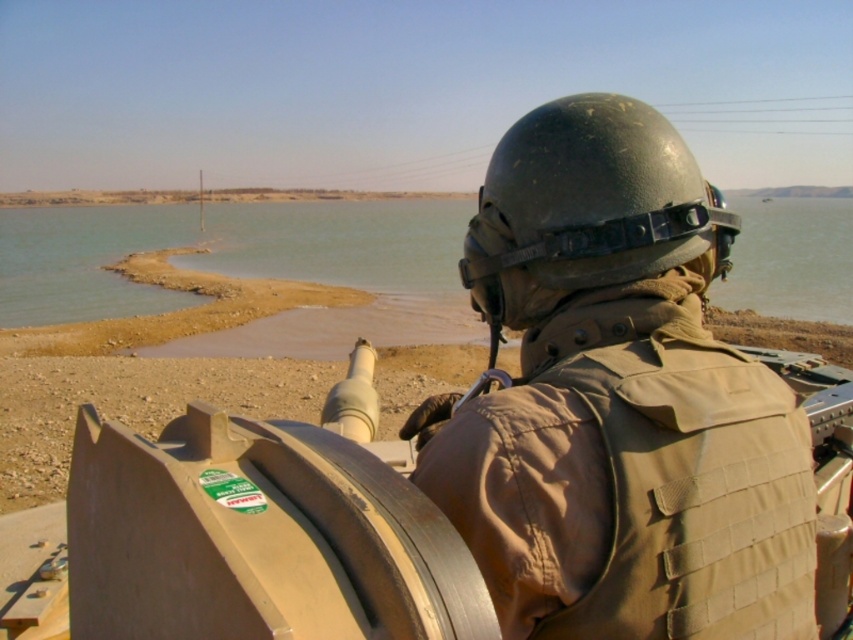
You are a photographer trying to capture the soldier and the sand in the background. Based on the scene, which object, the smooth sand at water center or the matte black helmet at center, would appear closer to the camera in the photo?

The smooth sand at water center is taller than the matte black helmet at center, so the smooth sand at water center would appear closer to the camera in the photo.

You are a photographer trying to capture the soldier in the vehicle. You notice two helmets at the center of your viewfinder. Which helmet is closer to you, the matte green helmet at center or the matte black helmet at center?

The matte green helmet at center is closer to you because it is in front of the matte black helmet at center in the scene.